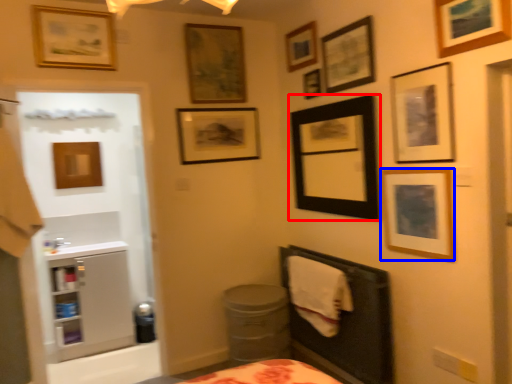
Question: Which object is closer to the camera taking this photo, picture frame (highlighted by a red box) or picture frame (highlighted by a blue box)?

Choices:
 (A) picture frame
 (B) picture frame

Answer: (B)